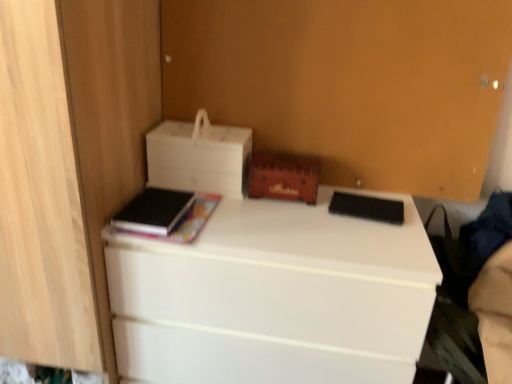
Question: In terms of size, does white matte desk at center appear bigger or smaller than white matte printer at upper left?

Choices:
 (A) small
 (B) big

Answer: (B)

Question: Is white matte desk at center in front of or behind white matte printer at upper left in the image?

Choices:
 (A) behind
 (B) front

Answer: (B)

Question: Based on their relative distances, which object is farther from the white matte desk at center?

Choices:
 (A) black matte paperback book at center, the first paperback book in the right-to-left sequence
 (B) white matte printer at upper left
 (C) wooden chest at center
 (D) black matte book at left, the 2th paperback book positioned from the right

Answer: (A)

Question: Estimate the real-world distances between objects in this image. Which object is farther from the wooden chest at center?

Choices:
 (A) white matte printer at upper left
 (B) black matte book at left, acting as the first paperback book starting from the left
 (C) white matte desk at center
 (D) black matte paperback book at center, the 2th paperback book when ordered from left to right

Answer: (C)